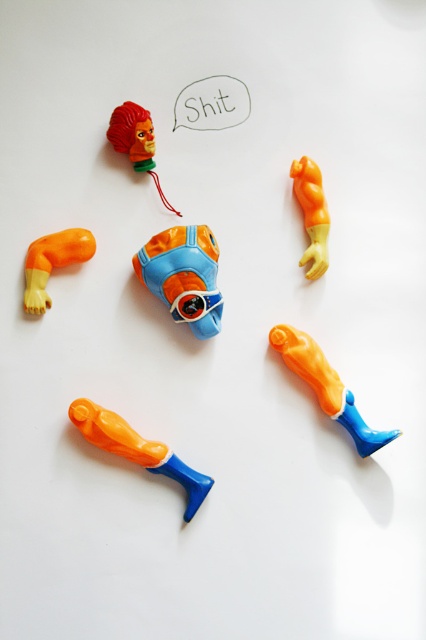
You are a child trying to assemble a superhero action figure. You have two pieces in front of you, the orange matte plastic arm at upper left and the matte plastic head at upper left. Which piece should you place on the left side of the figure to match the arrangement shown in the image?

You should place the orange matte plastic arm at upper left on the left side of the figure because it is positioned to the left of the matte plastic head at upper left in the image.

You are a child trying to assemble a superhero action figure. You have an orange matte plastic man at lower right and a matte plastic head at upper left. Which part should you attach first to ensure the head fits properly?

The orange matte plastic man at lower right is taller than the matte plastic head at upper left, so you should attach the matte plastic head at upper left first to ensure it fits properly on the taller torso.